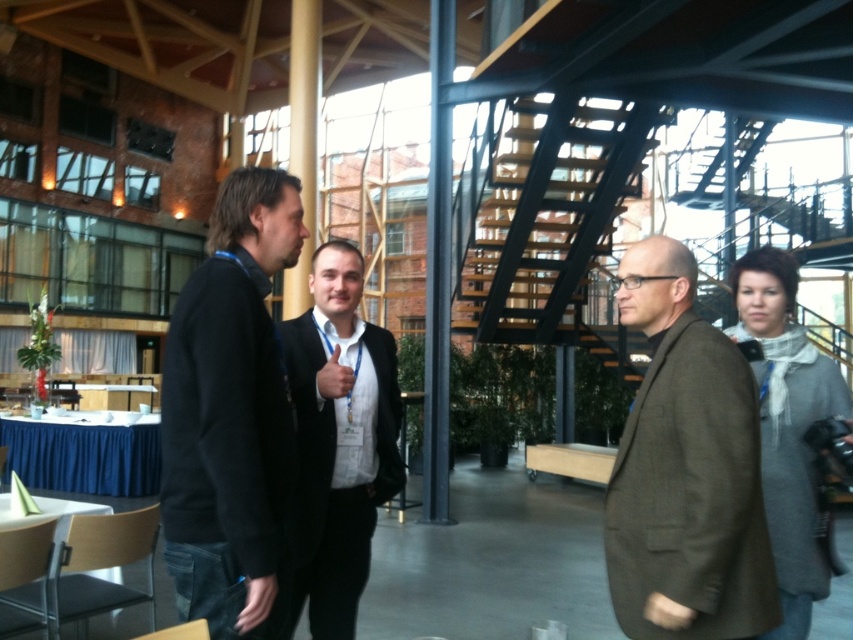
Which is in front, point (733, 532) or point (314, 524)?

Point (733, 532) is in front.

Find the location of `brown woolen jacket at center`. brown woolen jacket at center is located at coordinates (685, 470).

I want to click on brown woolen jacket at center, so click(x=685, y=470).

Can you confirm if dark gray sweater at center is taller than black suit at center?

In fact, dark gray sweater at center may be shorter than black suit at center.

Which of these two, dark gray sweater at center or black suit at center, stands taller?

With more height is black suit at center.

Is point (219, 593) positioned before point (329, 461)?

Yes, it is.

This screenshot has width=853, height=640. Identify the location of dark gray sweater at center. (230, 413).

Is point (233, 515) positioned after point (647, 493)?

No, (233, 515) is in front of (647, 493).

Locate an element on the screen. The height and width of the screenshot is (640, 853). dark gray sweater at center is located at coordinates (230, 413).

The width and height of the screenshot is (853, 640). I want to click on dark gray sweater at center, so [230, 413].